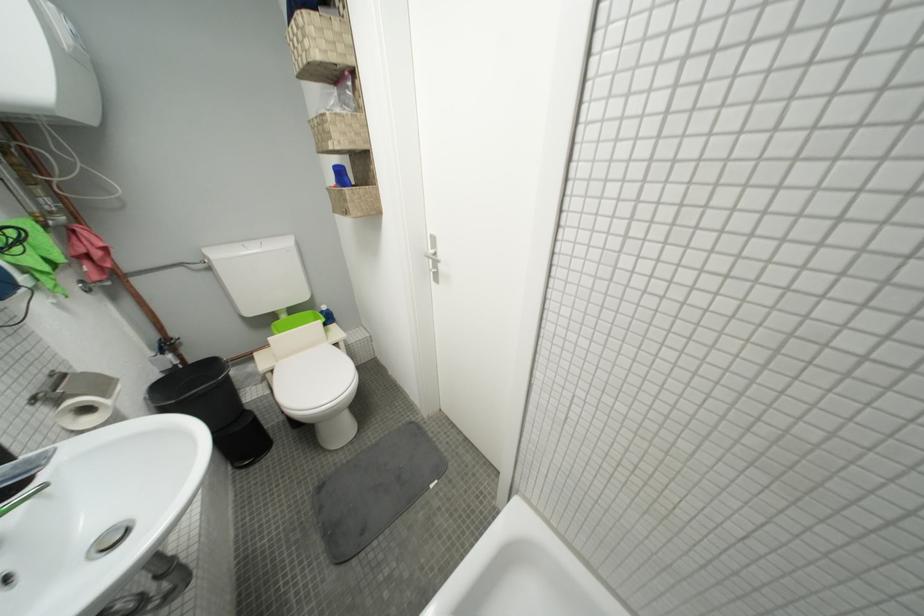
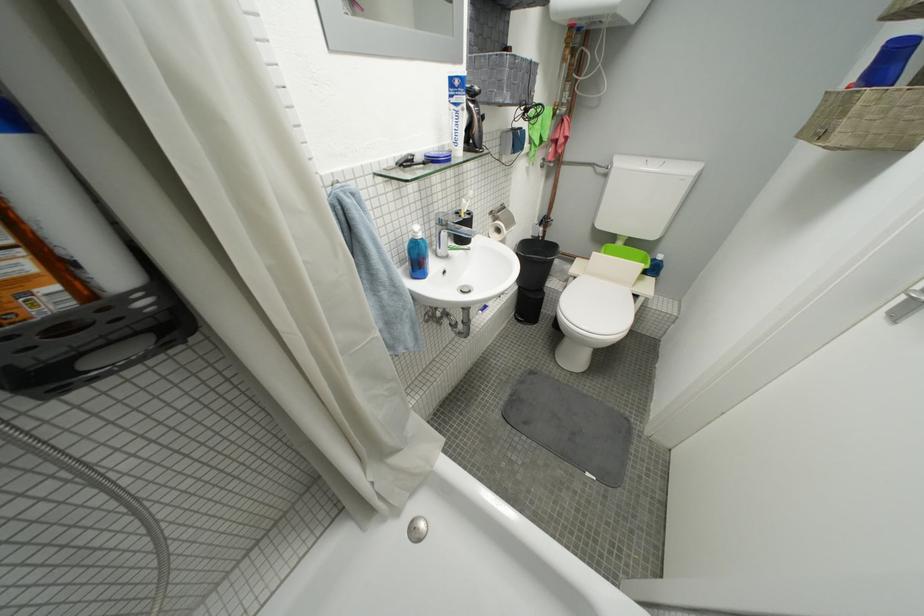
In the second image, find the point that corresponds to the point at 262,252 in the first image.

(662, 169)